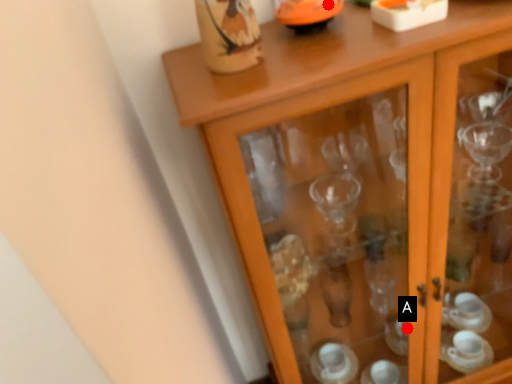
Question: Two points are circled on the image, labeled by A and B beside each circle. Which point is closer to the camera?

Choices:
 (A) A is closer
 (B) B is closer

Answer: (B)